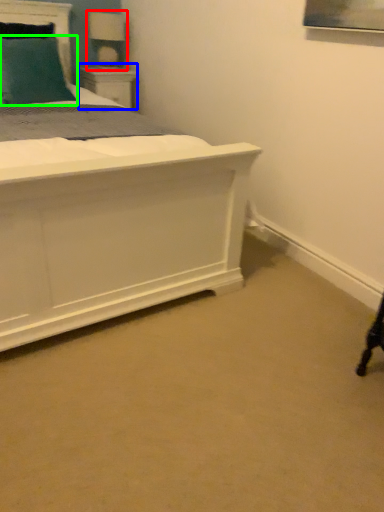
Question: Which object is the farthest from table lamp (highlighted by a red box)? Choose among these: nightstand (highlighted by a blue box) or pillow (highlighted by a green box).

Choices:
 (A) nightstand
 (B) pillow

Answer: (B)